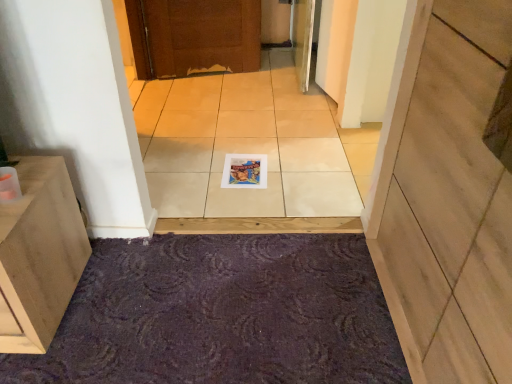
You are a GUI agent. You are given a task and a screenshot of the screen. Output one action in this format:
    pyautogui.click(x=<x>, y=<y>)
    Task: Click on the free space above purple textured bath mat at lower center (from a real-world perspective)
    
    Given the screenshot: What is the action you would take?
    pyautogui.click(x=194, y=311)